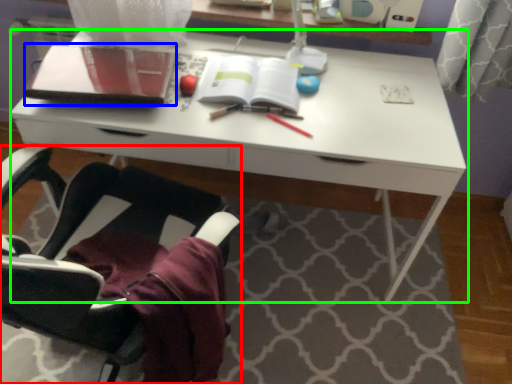
Question: Which object is positioned closest to chair (highlighted by a red box)? Select from notebook (highlighted by a blue box) and desk (highlighted by a green box).

Choices:
 (A) notebook
 (B) desk

Answer: (B)